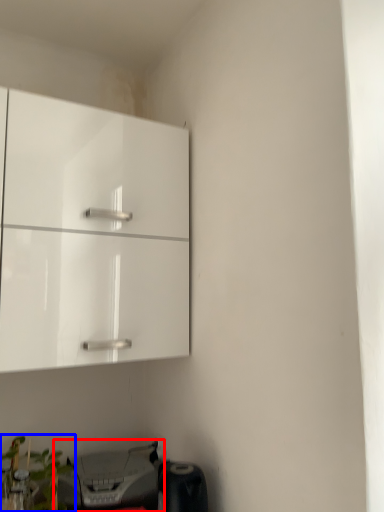
Question: Which object appears farthest to the camera in this image, printer (highlighted by a red box) or plant (highlighted by a blue box)?

Choices:
 (A) printer
 (B) plant

Answer: (A)